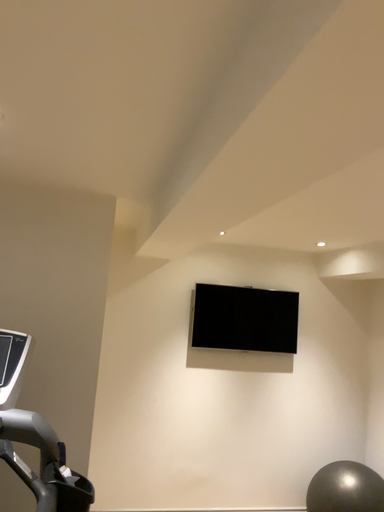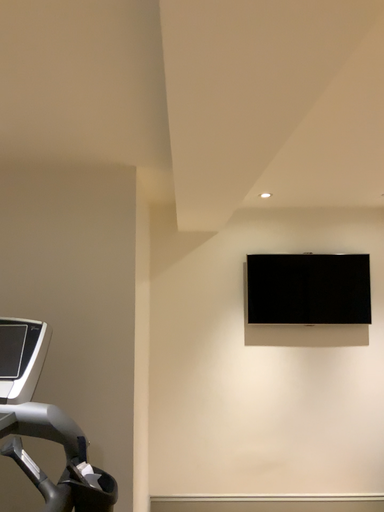
Question: Which way did the camera rotate in the video?

Choices:
 (A) rotated left
 (B) rotated right

Answer: (A)